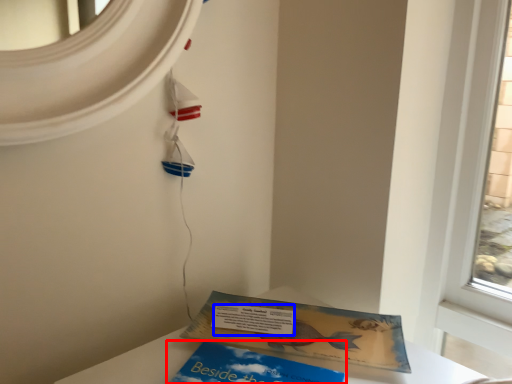
Question: Which object appears closest to the camera in this image, book (highlighted by a red box) or writing (highlighted by a blue box)?

Choices:
 (A) book
 (B) writing

Answer: (A)